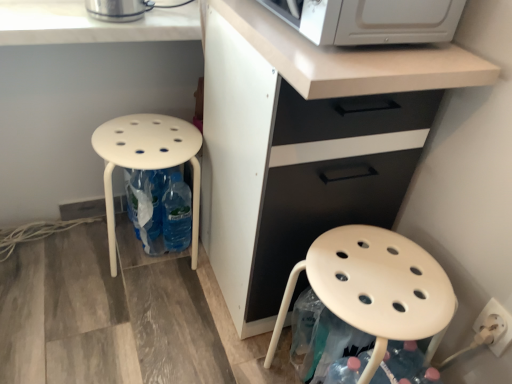
Question: Is white matte cabinet at center touching white plastic electric outlet at lower right?

Choices:
 (A) no
 (B) yes

Answer: (A)

Question: Considering the relative positions of white matte cabinet at center and white plastic electric outlet at lower right in the image provided, is white matte cabinet at center to the left of white plastic electric outlet at lower right from the viewer's perspective?

Choices:
 (A) no
 (B) yes

Answer: (B)

Question: Is white matte cabinet at center shorter than white plastic electric outlet at lower right?

Choices:
 (A) yes
 (B) no

Answer: (B)

Question: Is white plastic electric outlet at lower right inside white matte cabinet at center?

Choices:
 (A) yes
 (B) no

Answer: (B)

Question: Does white matte cabinet at center have a greater height compared to white plastic electric outlet at lower right?

Choices:
 (A) no
 (B) yes

Answer: (B)

Question: Is white matte cabinet at center wider than white plastic electric outlet at lower right?

Choices:
 (A) yes
 (B) no

Answer: (A)

Question: Can you confirm if matte white stool at lower left, marked as the 1th stool in a right-to-left arrangement, is bigger than white matte cabinet at center?

Choices:
 (A) no
 (B) yes

Answer: (A)

Question: Can you confirm if matte white stool at lower left, marked as the 1th stool in a right-to-left arrangement, is positioned to the right of white matte cabinet at center?

Choices:
 (A) no
 (B) yes

Answer: (B)

Question: Considering the relative sizes of matte white stool at lower left, acting as the second stool starting from the left, and white matte cabinet at center in the image provided, is matte white stool at lower left, acting as the second stool starting from the left, shorter than white matte cabinet at center?

Choices:
 (A) no
 (B) yes

Answer: (B)

Question: Is matte white stool at lower left, acting as the second stool starting from the left, positioned with its back to white matte cabinet at center?

Choices:
 (A) yes
 (B) no

Answer: (B)

Question: Is matte white stool at lower left, marked as the 1th stool in a right-to-left arrangement, smaller than white matte cabinet at center?

Choices:
 (A) yes
 (B) no

Answer: (A)

Question: From the image's perspective, is matte white stool at lower left, marked as the 1th stool in a right-to-left arrangement, on top of white matte cabinet at center?

Choices:
 (A) yes
 (B) no

Answer: (B)

Question: Is white matte cabinet at center surrounding matte white stool at lower left, acting as the second stool starting from the left?

Choices:
 (A) no
 (B) yes

Answer: (B)